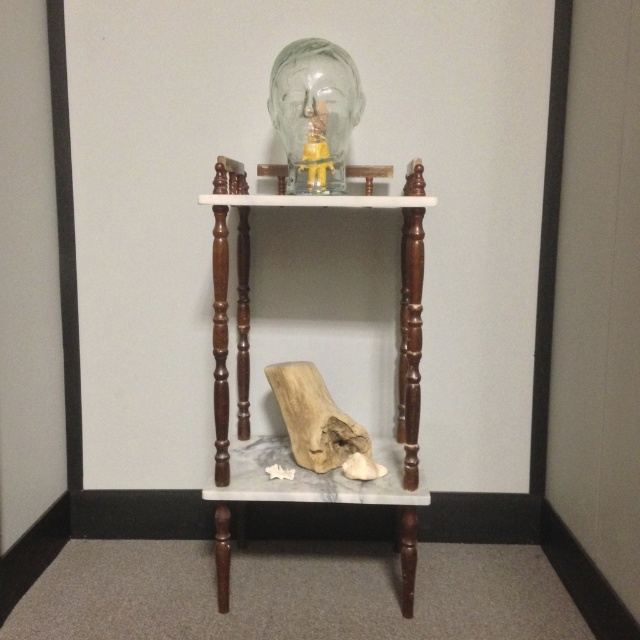
You are standing in front of a room with a wooden side table at center and a white marble stool at lower center. Which object is closer to you?

The wooden side table at center is closer to the viewer than the white marble stool at lower center.

You are arranging a living room and want to place a 1.2 meter wide sofa between the wooden side table at center and the white marble stool at lower center. Can the sofa fit in the space between them?

The wooden side table at center might be wider than white marble stool at lower center, but without knowing the exact distance between them, it is impossible to determine if the sofa will fit. Additional measurements are needed.

You are standing at the base of the wooden side table at center. You want to place a 1.5 meter long decorative pole on the floor between you and the wall. Will the pole fit without overlapping the table?

The distance between you and the wooden side table at center is 1.46 meters. Since the pole is 1.5 meters long, it will not fit as it is slightly longer than the available space.